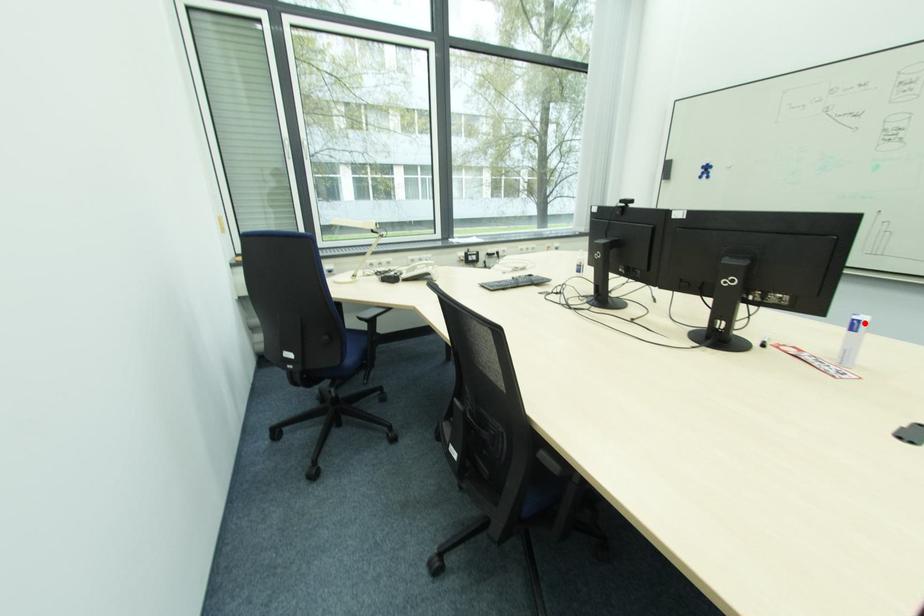
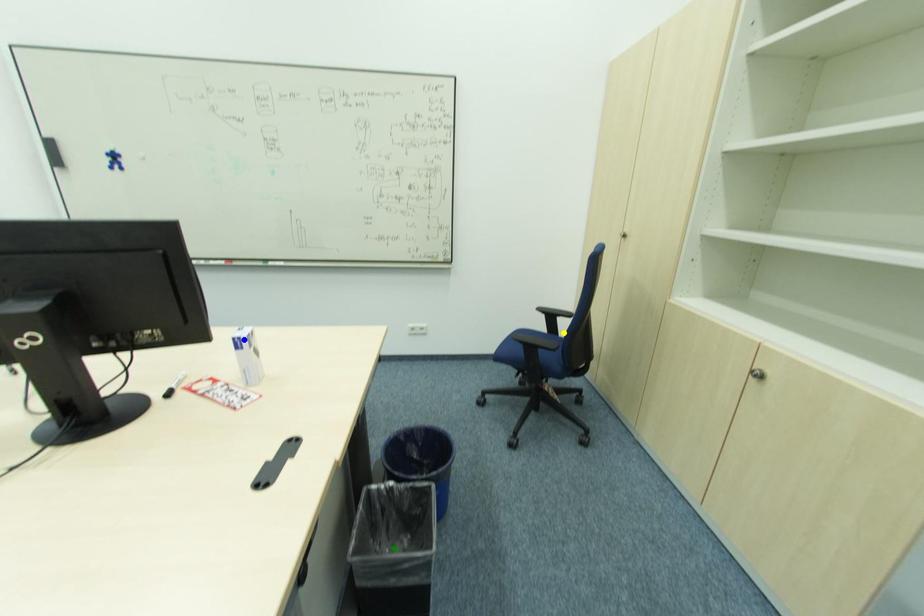
Question: I am providing you with two images of the same scene from different viewpoints. A red point is marked on the first image. You are given multiple points on the second image. Which point in image 2 is actually the same real-world point as the red point in image 1?

Choices:
 (A) green point
 (B) blue point
 (C) yellow point

Answer: (B)